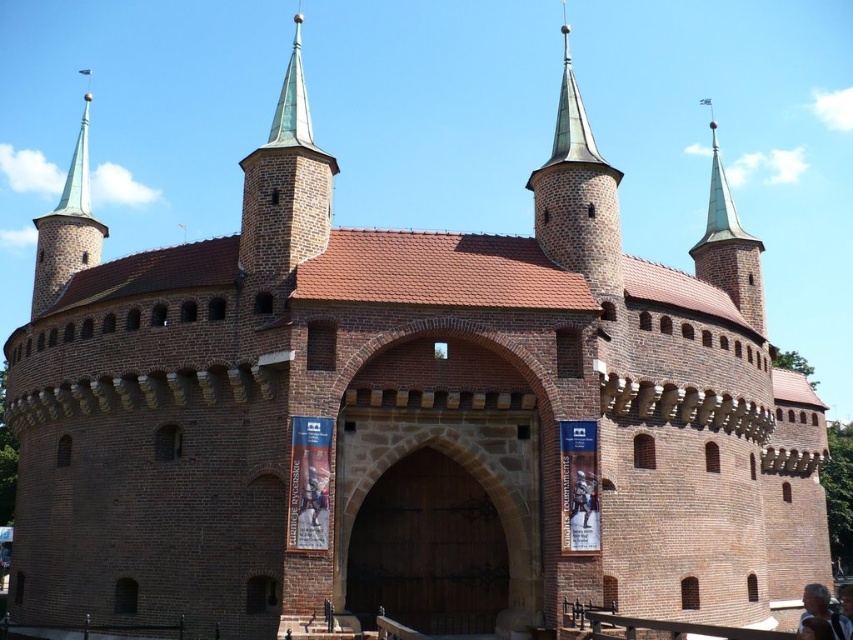
You are a tourist standing in front of the Barbakan in Krakow, Poland. You see the brown wooden gate at center and the green copper spire at upper center. Which object is positioned to the left of the other?

The brown wooden gate at center is to the left of green copper spire at upper center.

You are a tour guide explaining the Barbakan to visitors. You mention the brown wooden gate at center and the green copper spire at upper center. Which object is wider in terms of their widths?

The brown wooden gate at center is thinner than the green copper spire at upper center, so the green copper spire at upper center is wider.

You are a tourist standing in front of the Barbakan gatehouse. You notice two spires on the roof. Which spire is located to the left of the other? The green copper spire at upper left or the shiny copper spire at upper right?

The green copper spire at upper left is positioned on the left side of the shiny copper spire at upper right.